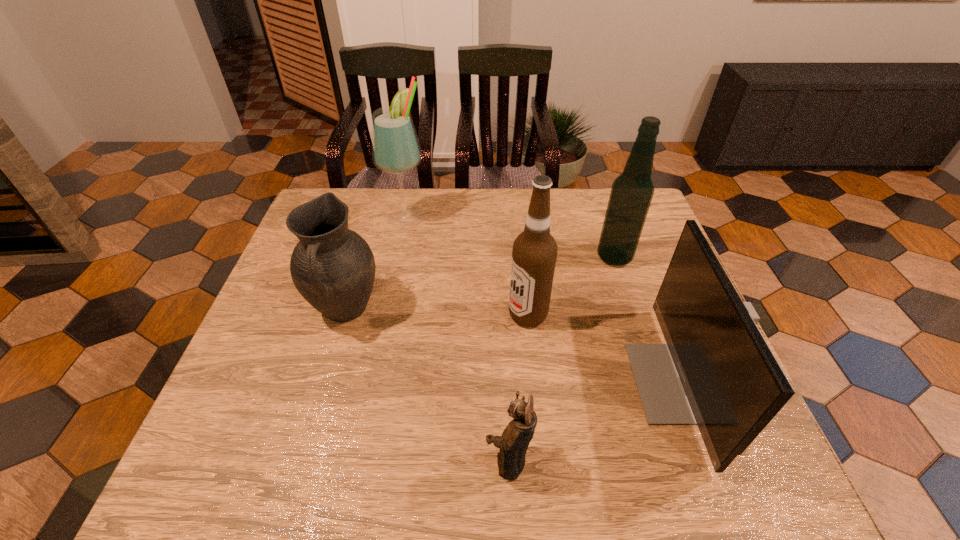
At what (x,y) coordinates should I click in order to perform the action: click on the farthest object. Please return your answer as a coordinate pair (x, y). This screenshot has width=960, height=540. Looking at the image, I should click on (396, 150).

Locate an element on the screen. The width and height of the screenshot is (960, 540). the leftmost alcohol is located at coordinates (396, 150).

Where is `the second farthest alcohol`? The width and height of the screenshot is (960, 540). the second farthest alcohol is located at coordinates (631, 194).

Where is `the rightmost alcohol`? The height and width of the screenshot is (540, 960). the rightmost alcohol is located at coordinates (631, 194).

You are a GUI agent. You are given a task and a screenshot of the screen. Output one action in this format:
    pyautogui.click(x=<x>, y=<y>)
    Task: Click on the second alcohol from left to right
    This screenshot has width=960, height=540.
    Given the screenshot: What is the action you would take?
    pyautogui.click(x=534, y=254)

I want to click on pitcher, so click(x=333, y=268).

I want to click on computer monitor, so click(717, 371).

You are a GUI agent. You are given a task and a screenshot of the screen. Output one action in this format:
    pyautogui.click(x=<x>, y=<y>)
    Task: Click on the shortest object
    This screenshot has height=540, width=960.
    Given the screenshot: What is the action you would take?
    pyautogui.click(x=515, y=439)

I want to click on free region located 0.170m on the left of the farthest object, so click(x=329, y=217).

You are a GUI agent. You are given a task and a screenshot of the screen. Output one action in this format:
    pyautogui.click(x=<x>, y=<y>)
    Task: Click on the free spot located 0.180m on the left of the rightmost alcohol
    
    Given the screenshot: What is the action you would take?
    pyautogui.click(x=532, y=257)